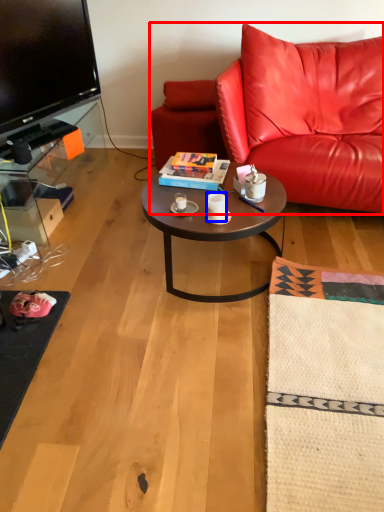
Question: Which of the following is the closest to the observer, studio couch (highlighted by a red box) or coffee cup (highlighted by a blue box)?

Choices:
 (A) studio couch
 (B) coffee cup

Answer: (A)